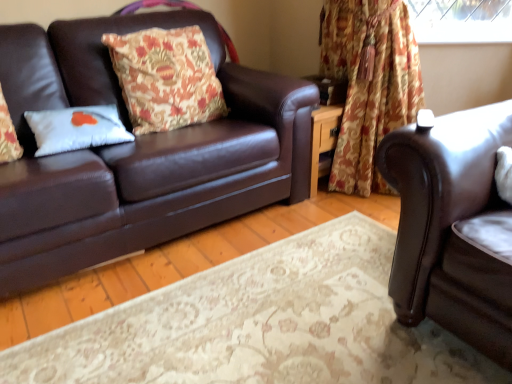
Question: In the image, is matte brown leather couch at left, which is counted as the first studio couch, starting from the left, positioned in front of or behind floral fabric curtain at upper right?

Choices:
 (A) behind
 (B) front

Answer: (B)

Question: Do you think matte brown leather couch at left, which is counted as the first studio couch, starting from the left, is within floral fabric curtain at upper right, or outside of it?

Choices:
 (A) outside
 (B) inside

Answer: (A)

Question: Estimate the real-world distances between objects in this image. Which object is closer to the brown leather couch at right, which is the first studio couch from right to left?

Choices:
 (A) matte brown leather couch at left, which is counted as the first studio couch, starting from the left
 (B) white matte pillow at left, the 1th pillow from the left
 (C) floral-patterned fabric pillow at left, the first pillow viewed from the right
 (D) floral fabric curtain at upper right

Answer: (D)

Question: Estimate the real-world distances between objects in this image. Which object is closer to the brown leather couch at right, the second studio couch positioned from the left?

Choices:
 (A) floral fabric curtain at upper right
 (B) white matte pillow at left, the 1th pillow from the left
 (C) floral-patterned fabric pillow at left, placed as the 2th pillow when sorted from left to right
 (D) matte brown leather couch at left, which is counted as the first studio couch, starting from the left

Answer: (A)